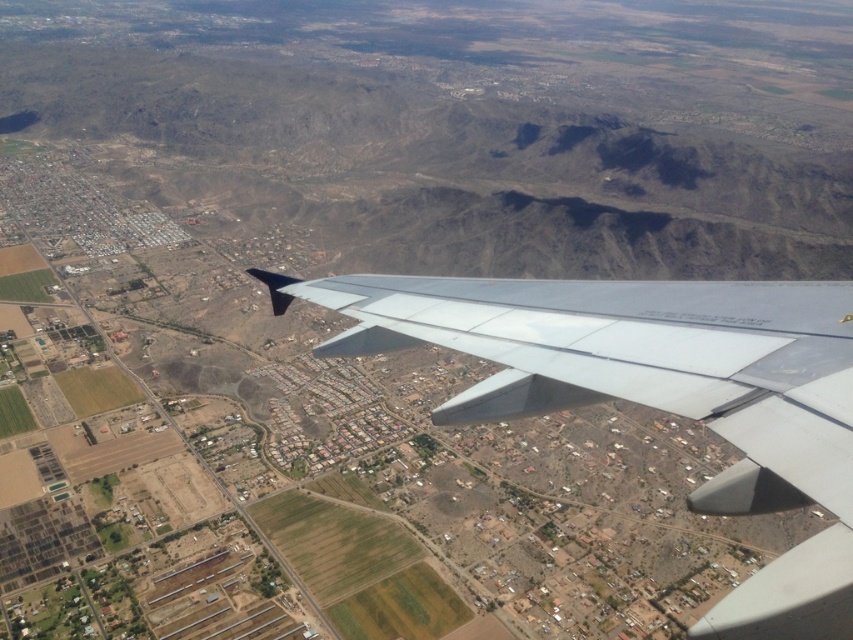
Describe the element at coordinates (657, 394) in the screenshot. I see `metallic gray wing at center` at that location.

Is point (824, 458) positioned behind point (408, 280)?

No, (824, 458) is in front of (408, 280).

At what (x,y) coordinates should I click in order to perform the action: click on metallic gray wing at center. Please return your answer as a coordinate pair (x, y). The height and width of the screenshot is (640, 853). Looking at the image, I should click on (657, 394).